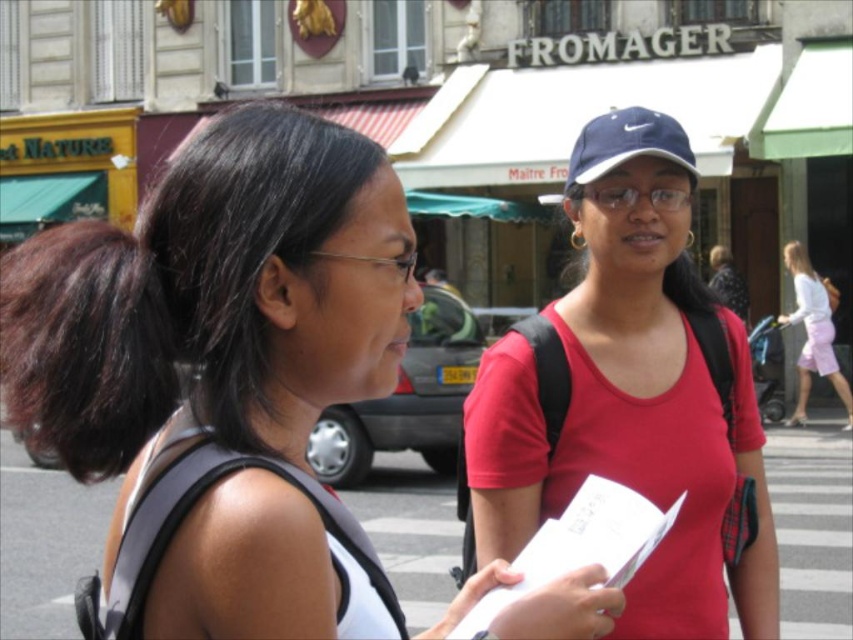
You are a delivery person who needs to carry an extra package. You see the matte black backpack at left and the navy blue fabric baseball cap at upper right. Which item can you use to carry the package?

The matte black backpack at left has a larger size compared to the navy blue fabric baseball cap at upper right, so you can use the matte black backpack at left to carry the package.

You are a fashion designer observing two items in the image. The first is the red matte tank top at center, and the second is the navy blue fabric baseball cap at upper right. Which of these two items has a greater width?

The red matte tank top at center has a greater width than the navy blue fabric baseball cap at upper right according to the description.